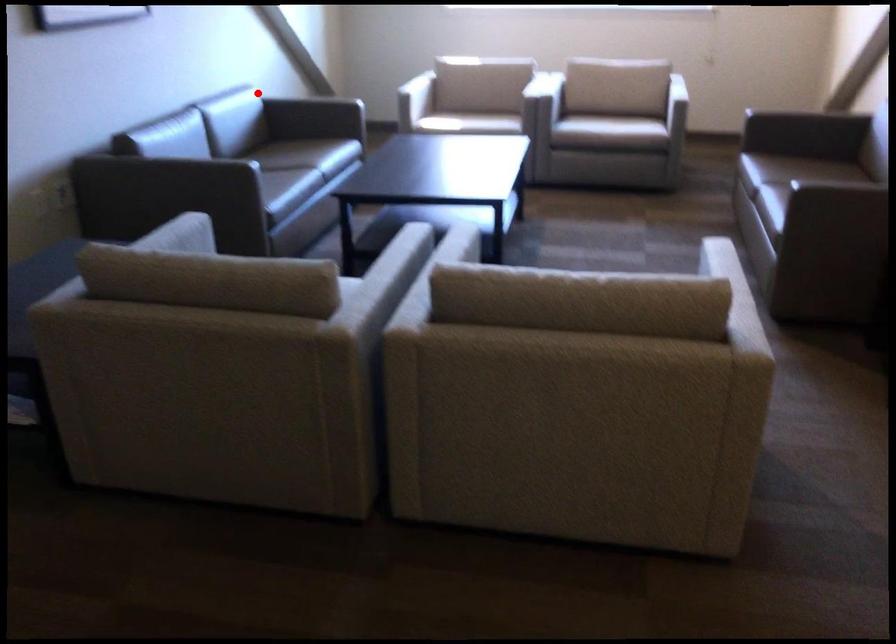
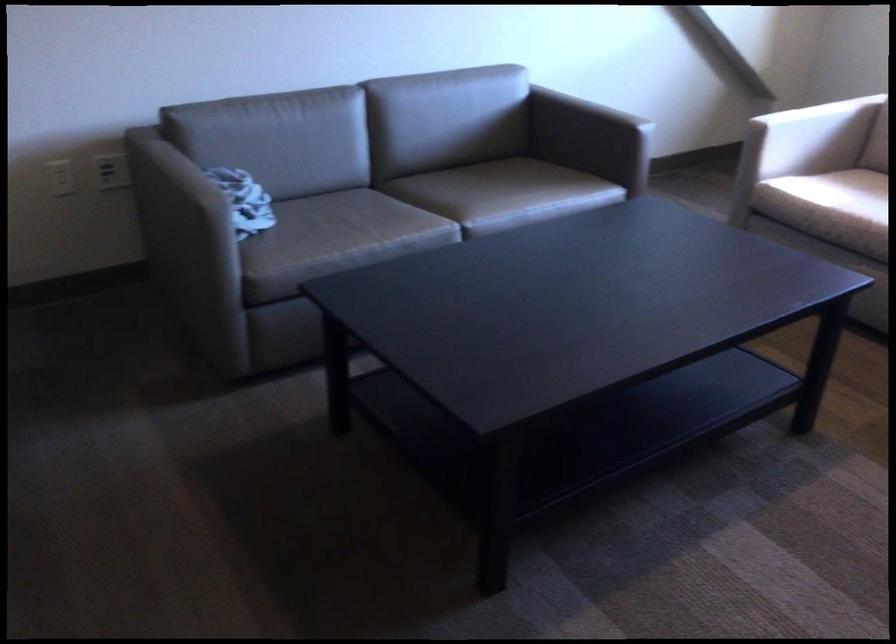
In the second image, find the point that corresponds to the highlighted location in the first image.

(605, 93)